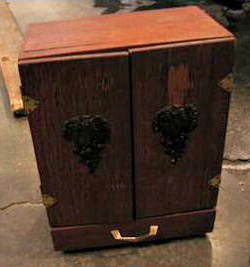
At what (x,y) coordinates should I click in order to perform the action: click on hinge. Please return your answer as a coordinate pair (x, y). Looking at the image, I should click on (50, 201), (31, 102), (221, 81), (213, 179).